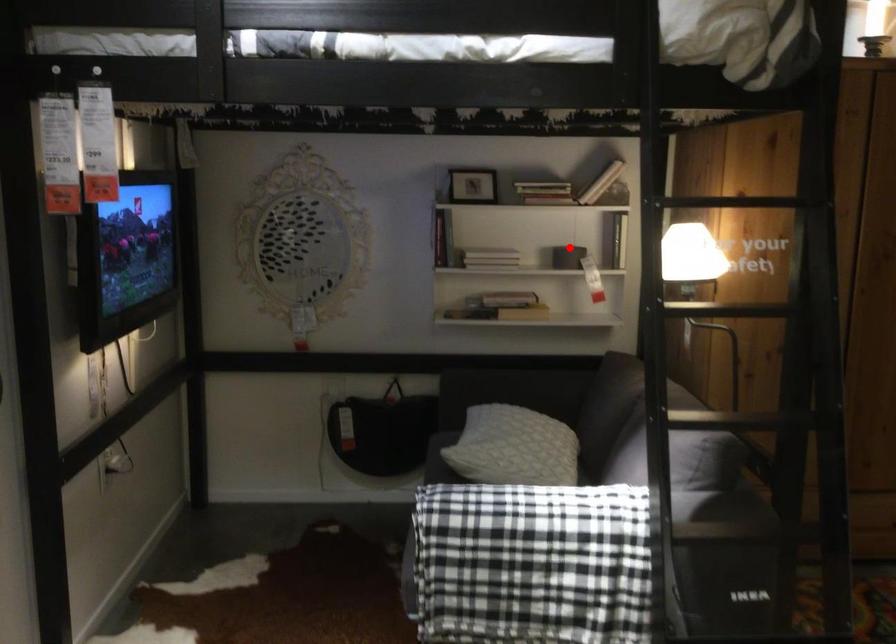
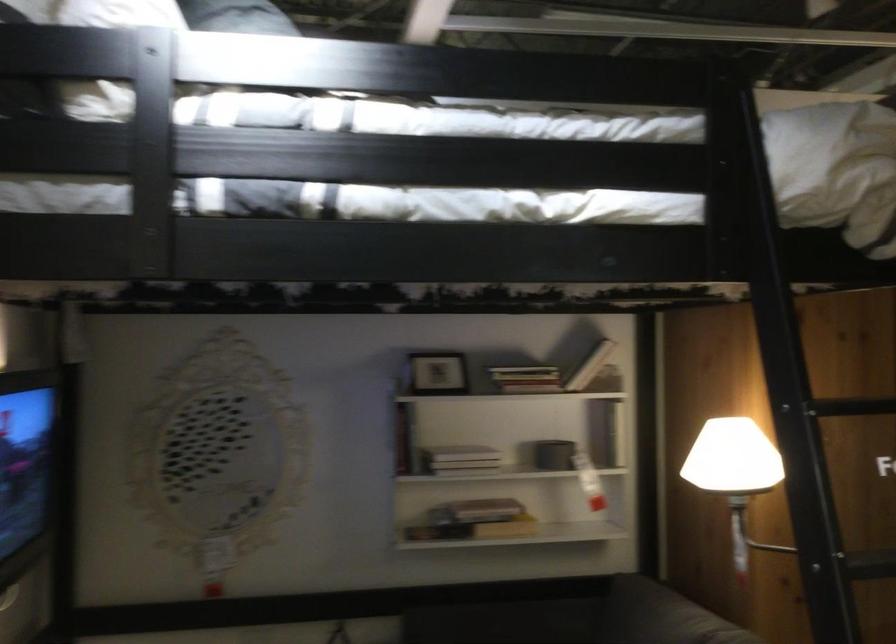
In the second image, find the point that corresponds to the highlighted location in the first image.

(553, 453)